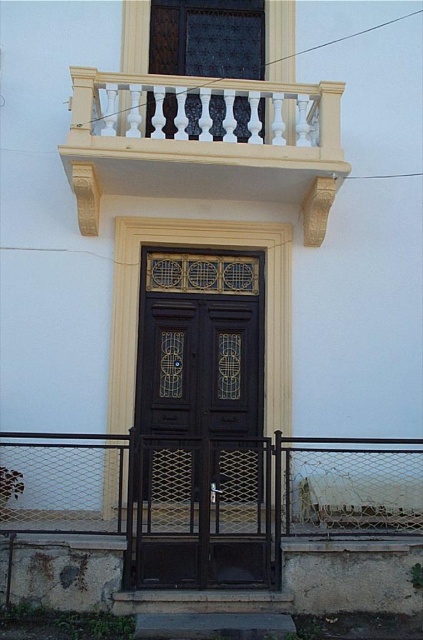
Question: Among these objects, which one is farthest from the camera?

Choices:
 (A) dark wood door at center
 (B) white carved wood balcony at upper center

Answer: (A)

Question: Is dark wood door at center behind white carved wood balcony at upper center?

Choices:
 (A) no
 (B) yes

Answer: (B)

Question: Which point is farther to the camera?

Choices:
 (A) (299, 196)
 (B) (233, 419)

Answer: (A)

Question: Can you confirm if dark wood door at center is thinner than white carved wood balcony at upper center?

Choices:
 (A) no
 (B) yes

Answer: (B)

Question: Is dark wood door at center smaller than white carved wood balcony at upper center?

Choices:
 (A) yes
 (B) no

Answer: (A)